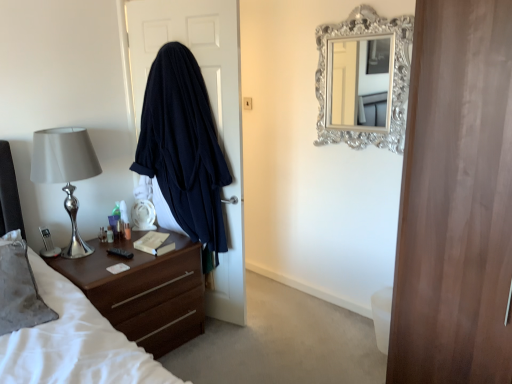
Locate an element on the screen. The height and width of the screenshot is (384, 512). free space in front of black plastic remote control at left is located at coordinates (113, 268).